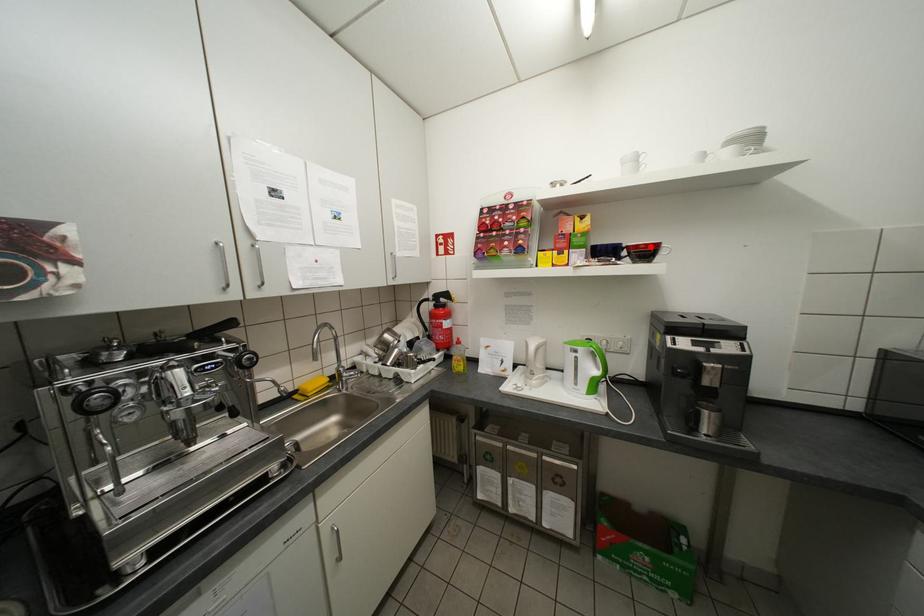
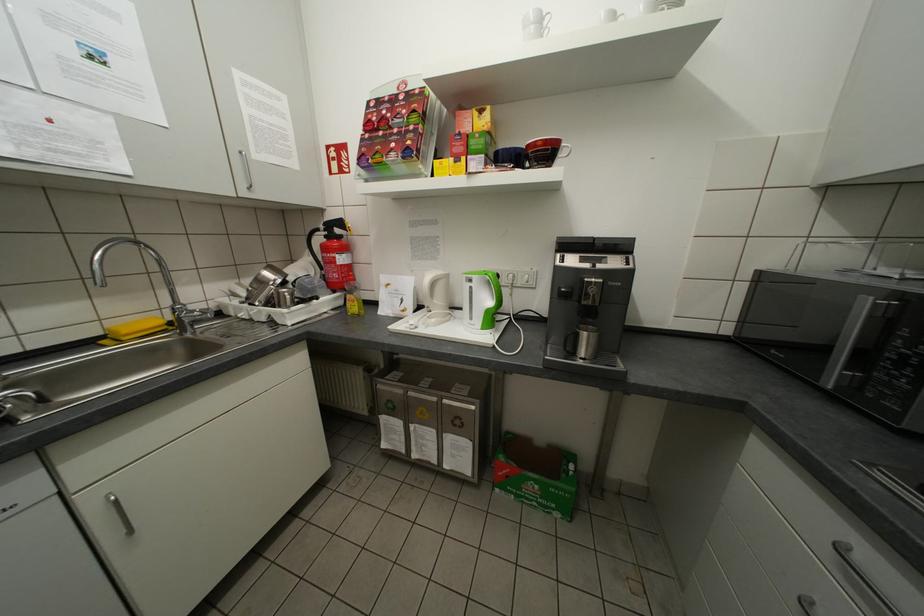
Find the pixel in the second image that matches the highlighted location in the first image.

(548, 144)